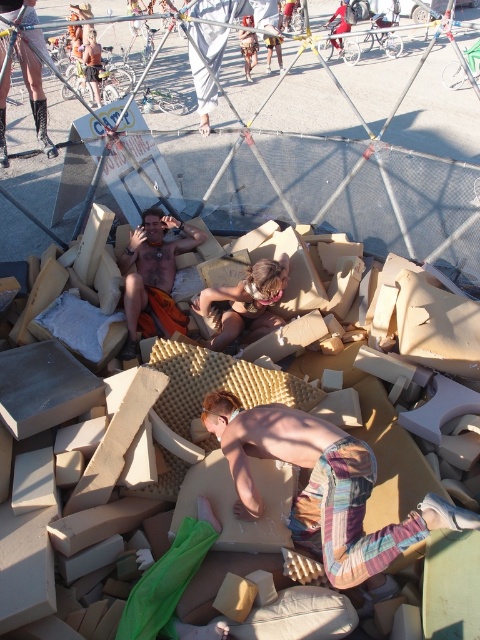
Who is lower down, shiny orange shorts at center or brown textured fabric at center?

brown textured fabric at center is below.

Between shiny orange shorts at center and brown textured fabric at center, which one has more height?

shiny orange shorts at center

Between point (180, 236) and point (249, 289), which one is positioned behind?

The point (180, 236) is more distant.

At what (x,y) coordinates should I click in order to perform the action: click on shiny orange shorts at center. Please return your answer as a coordinate pair (x, y). This screenshot has height=640, width=480. Looking at the image, I should click on (154, 276).

Who is more forward, (297, 516) or (268, 324)?

Point (297, 516)

Consider the image. Which is below, striped cotton shorts at center or brown textured fabric at center?

striped cotton shorts at center

Between point (308, 422) and point (237, 332), which one is positioned behind?

The point (237, 332) is more distant.

Identify the location of striped cotton shorts at center. Image resolution: width=480 pixels, height=640 pixels. (324, 490).

Does striped cotton shorts at center have a greater height compared to shiny orange shorts at center?

In fact, striped cotton shorts at center may be shorter than shiny orange shorts at center.

Who is more distant from viewer, [393,541] or [168,248]?

Positioned behind is point [168,248].

At what (x,y) coordinates should I click in order to perform the action: click on striped cotton shorts at center. Please return your answer as a coordinate pair (x, y). The width and height of the screenshot is (480, 640). Looking at the image, I should click on (324, 490).